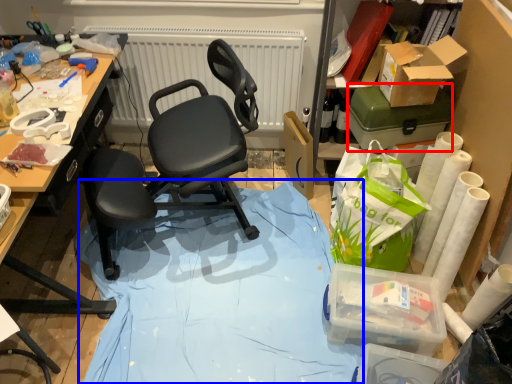
Question: Among these objects, which one is farthest to the camera, box (highlighted by a red box) or fabric (highlighted by a blue box)?

Choices:
 (A) box
 (B) fabric

Answer: (A)